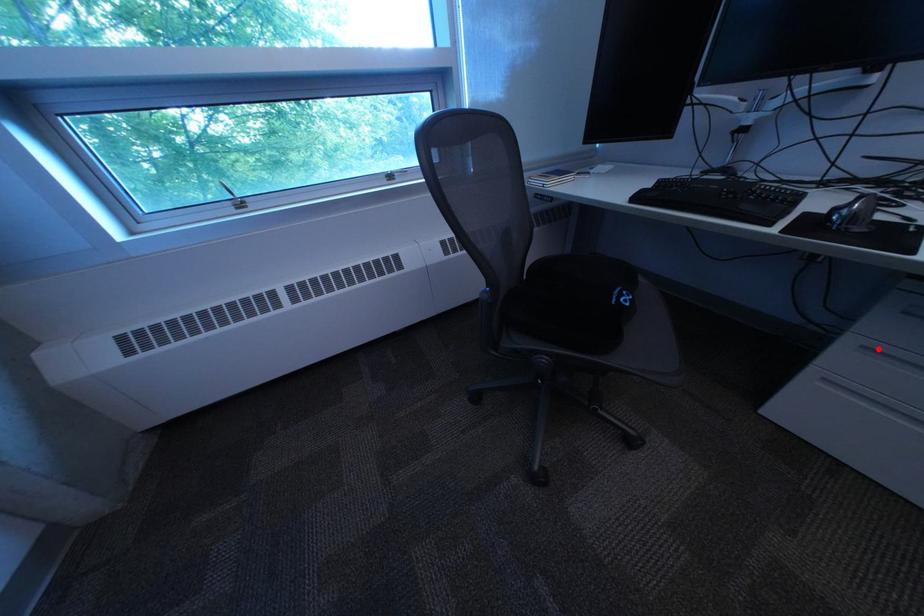
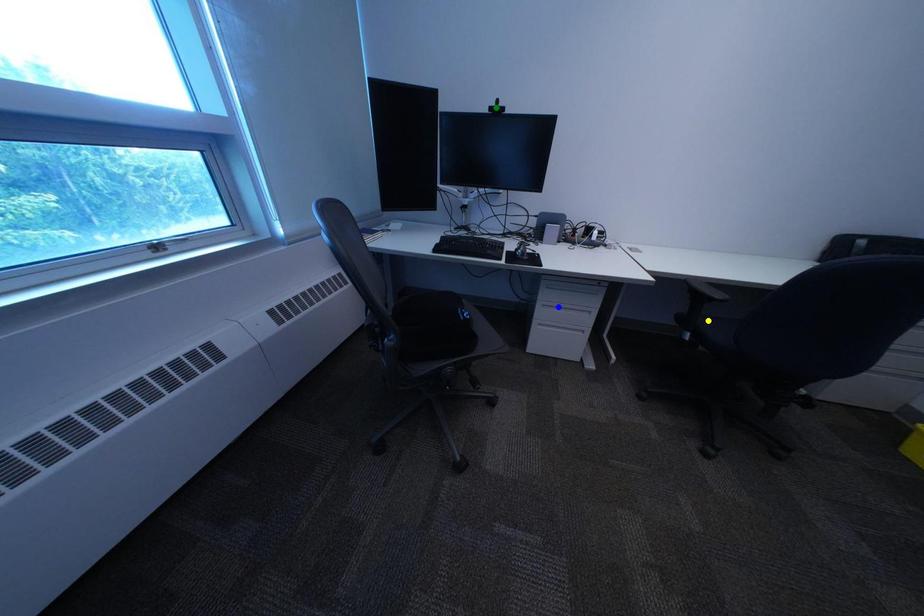
Question: I am providing you with two images of the same scene from different viewpoints. A red point is marked on the first image. You are given multiple points on the second image. Which mark in image 2 goes with the point in image 1?

Choices:
 (A) blue point
 (B) green point
 (C) yellow point

Answer: (A)